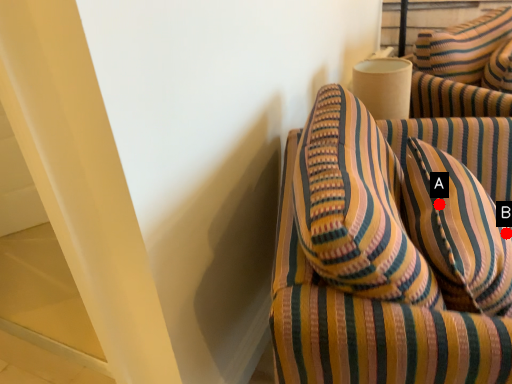
Question: Two points are circled on the image, labeled by A and B beside each circle. Which of the following is the farthest from the observer?

Choices:
 (A) A is further
 (B) B is further

Answer: (A)